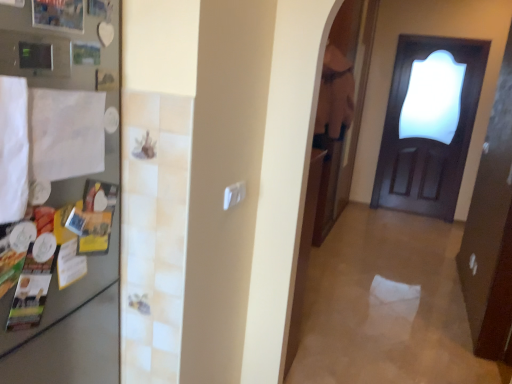
Question: From a real-world perspective, does dark wood door at right sit lower than satin silver fridge at left?

Choices:
 (A) yes
 (B) no

Answer: (A)

Question: Is dark wood door at right oriented towards satin silver fridge at left?

Choices:
 (A) yes
 (B) no

Answer: (A)

Question: Is the depth of dark wood door at right less than that of satin silver fridge at left?

Choices:
 (A) no
 (B) yes

Answer: (A)

Question: Considering the relative sizes of dark wood door at right and satin silver fridge at left in the image provided, is dark wood door at right bigger than satin silver fridge at left?

Choices:
 (A) yes
 (B) no

Answer: (A)

Question: Is dark wood door at right outside of satin silver fridge at left?

Choices:
 (A) no
 (B) yes

Answer: (B)

Question: Does dark wood door at right have a greater width compared to satin silver fridge at left?

Choices:
 (A) yes
 (B) no

Answer: (A)

Question: Does satin silver fridge at left lie in front of dark wood door at right?

Choices:
 (A) yes
 (B) no

Answer: (A)

Question: Can you confirm if satin silver fridge at left is smaller than dark wood door at right?

Choices:
 (A) yes
 (B) no

Answer: (A)

Question: Is satin silver fridge at left far from dark wood door at right?

Choices:
 (A) yes
 (B) no

Answer: (A)

Question: From a real-world perspective, is satin silver fridge at left physically below dark wood door at right?

Choices:
 (A) no
 (B) yes

Answer: (A)

Question: Is satin silver fridge at left to the right of dark wood door at right from the viewer's perspective?

Choices:
 (A) no
 (B) yes

Answer: (A)

Question: Is satin silver fridge at left positioned with its back to dark wood door at right?

Choices:
 (A) no
 (B) yes

Answer: (A)

Question: In terms of size, does satin silver fridge at left appear bigger or smaller than dark wood door at right?

Choices:
 (A) small
 (B) big

Answer: (A)